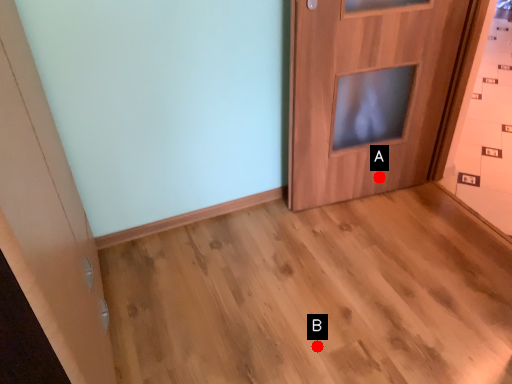
Question: Two points are circled on the image, labeled by A and B beside each circle. Which of the following is the closest to the observer?

Choices:
 (A) A is closer
 (B) B is closer

Answer: (B)